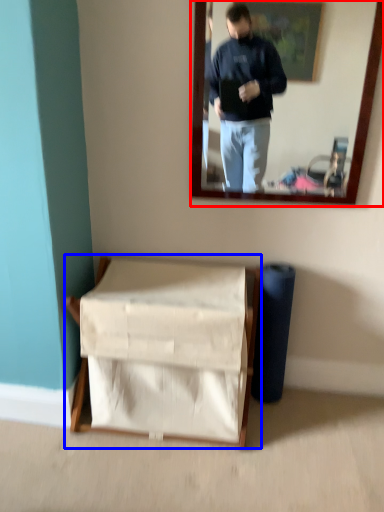
Question: Which point is closer to the camera, mirror (highlighted by a red box) or furniture (highlighted by a blue box)?

Choices:
 (A) mirror
 (B) furniture

Answer: (A)